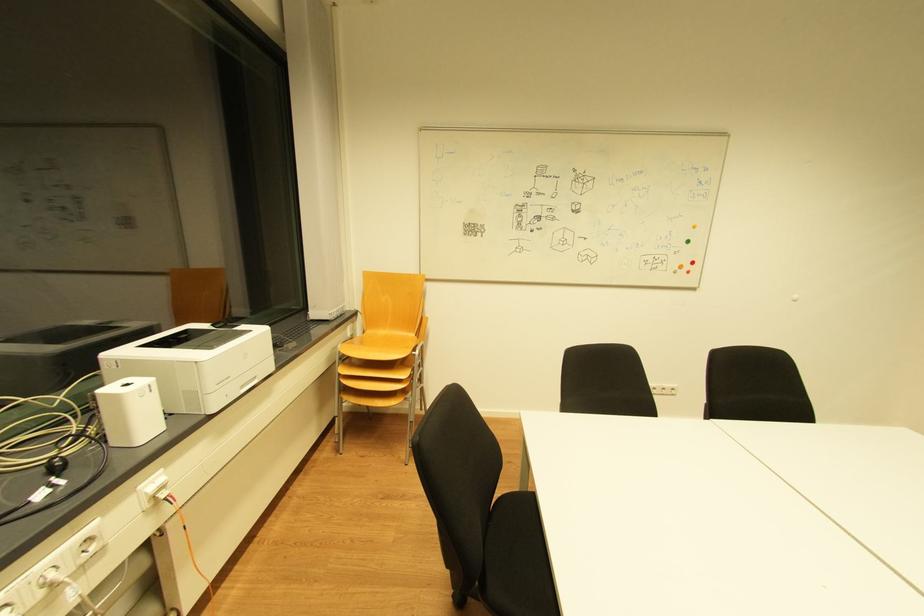
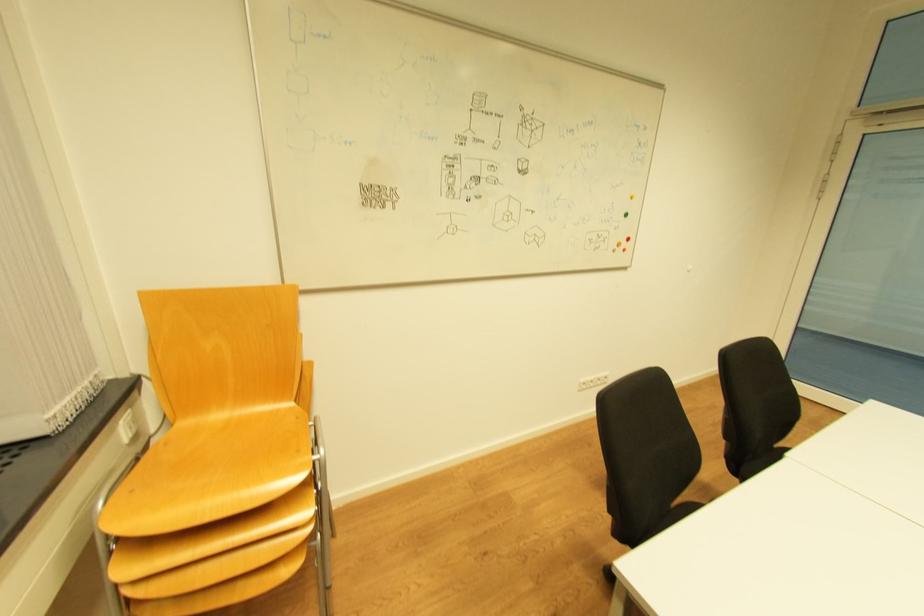
Question: What movement of the cameraman would produce the second image?

Choices:
 (A) Left
 (B) Right
 (C) Forward
 (D) Backward

Answer: (C)